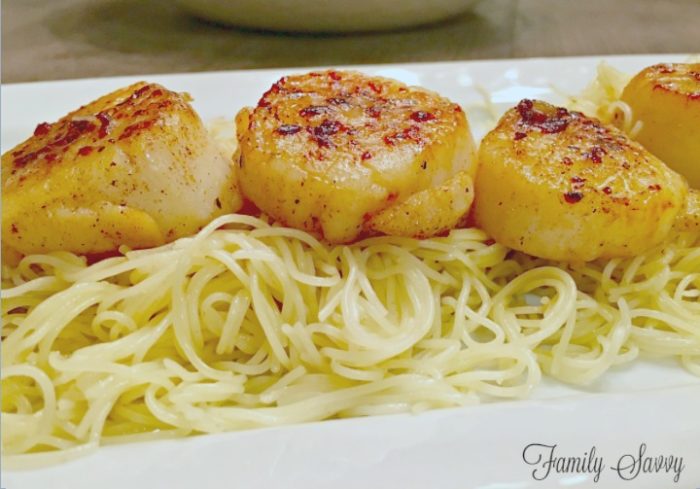
This screenshot has width=700, height=489. Find the location of `wood tabel`. wood tabel is located at coordinates [x=550, y=23], [x=113, y=70].